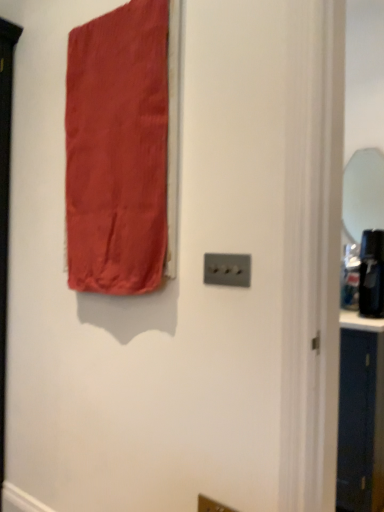
Question: Is satin red curtain at upper left positioned with its back to satin silver light switch at center?

Choices:
 (A) no
 (B) yes

Answer: (A)

Question: Is satin red curtain at upper left bigger than satin silver light switch at center?

Choices:
 (A) yes
 (B) no

Answer: (A)

Question: Is satin silver light switch at center surrounded by satin red curtain at upper left?

Choices:
 (A) yes
 (B) no

Answer: (B)

Question: Is satin red curtain at upper left next to satin silver light switch at center and touching it?

Choices:
 (A) yes
 (B) no

Answer: (B)

Question: From the image's perspective, would you say satin red curtain at upper left is positioned over satin silver light switch at center?

Choices:
 (A) no
 (B) yes

Answer: (B)

Question: Does point (365, 161) appear closer or farther from the camera than point (150, 259)?

Choices:
 (A) farther
 (B) closer

Answer: (A)

Question: Choose the correct answer: Is clear glass mirror at right inside satin red curtain at upper left or outside it?

Choices:
 (A) outside
 (B) inside

Answer: (A)

Question: From their relative heights in the image, would you say clear glass mirror at right is taller or shorter than satin red curtain at upper left?

Choices:
 (A) tall
 (B) short

Answer: (B)

Question: Considering the relative positions of clear glass mirror at right and satin red curtain at upper left in the image provided, is clear glass mirror at right to the left or to the right of satin red curtain at upper left?

Choices:
 (A) left
 (B) right

Answer: (B)

Question: From a real-world perspective, is satin red curtain at upper left physically located above or below satin silver light switch at center?

Choices:
 (A) below
 (B) above

Answer: (B)

Question: Do you think satin red curtain at upper left is within satin silver light switch at center, or outside of it?

Choices:
 (A) outside
 (B) inside

Answer: (A)

Question: Is satin red curtain at upper left taller or shorter than satin silver light switch at center?

Choices:
 (A) tall
 (B) short

Answer: (A)

Question: Based on their sizes in the image, would you say satin red curtain at upper left is bigger or smaller than satin silver light switch at center?

Choices:
 (A) small
 (B) big

Answer: (B)

Question: In terms of width, does clear glass mirror at right look wider or thinner when compared to satin silver light switch at center?

Choices:
 (A) thin
 (B) wide

Answer: (B)

Question: Relative to satin silver light switch at center, is clear glass mirror at right in front or behind?

Choices:
 (A) front
 (B) behind

Answer: (B)